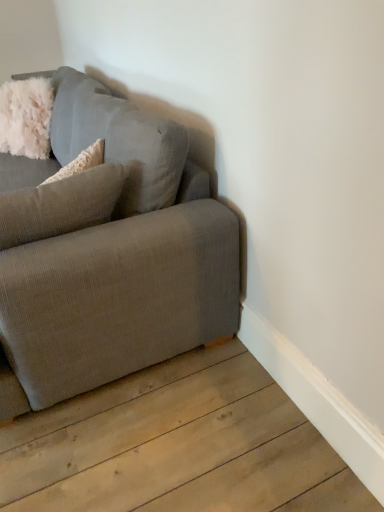
The width and height of the screenshot is (384, 512). Describe the element at coordinates (60, 205) in the screenshot. I see `fluffy white pillow at left` at that location.

Locate an element on the screen. fluffy white pillow at left is located at coordinates (60, 205).

What do you see at coordinates (109, 251) in the screenshot?
I see `textured gray couch at left` at bounding box center [109, 251].

You are a GUI agent. You are given a task and a screenshot of the screen. Output one action in this format:
    pyautogui.click(x=<x>, y=<y>)
    Task: Click on the textured gray couch at left
    The width and height of the screenshot is (384, 512).
    Given the screenshot: What is the action you would take?
    pyautogui.click(x=109, y=251)

Where is `fluffy white pillow at left`? The height and width of the screenshot is (512, 384). fluffy white pillow at left is located at coordinates (60, 205).

Is textured gray couch at left at the left side of fluffy white pillow at left?

Yes, textured gray couch at left is to the left of fluffy white pillow at left.

Is textured gray couch at left further to camera compared to fluffy white pillow at left?

No, the depth of textured gray couch at left is less than that of fluffy white pillow at left.

Is point (207, 197) in front of point (113, 202)?

No, (207, 197) is behind (113, 202).

From the image's perspective, which one is positioned higher, textured gray couch at left or fluffy white pillow at left?

From the image's view, textured gray couch at left is above.

From a real-world perspective, which is physically below, textured gray couch at left or fluffy white pillow at left?

From a 3D spatial view, textured gray couch at left is below.

Can you confirm if textured gray couch at left is wider than fluffy white pillow at left?

Yes, textured gray couch at left is wider than fluffy white pillow at left.

Can you confirm if textured gray couch at left is shorter than fluffy white pillow at left?

In fact, textured gray couch at left may be taller than fluffy white pillow at left.

Based on the photo, does textured gray couch at left have a smaller size compared to fluffy white pillow at left?

No.

Which is correct: textured gray couch at left is inside fluffy white pillow at left, or outside of it?

textured gray couch at left is located beyond the bounds of fluffy white pillow at left.

Does textured gray couch at left touch fluffy white pillow at left?

No.

Could you tell me if textured gray couch at left is facing fluffy white pillow at left?

Yes.

This screenshot has height=512, width=384. In order to click on studio couch located on the left of fluffy white pillow at left in this screenshot , I will do `click(109, 251)`.

Is fluffy white pillow at left to the left of textured gray couch at left from the viewer's perspective?

Incorrect, fluffy white pillow at left is not on the left side of textured gray couch at left.

Which is behind, fluffy white pillow at left or textured gray couch at left?

Positioned behind is fluffy white pillow at left.

Which is in front, point (88, 203) or point (183, 132)?

Positioned in front is point (88, 203).

From the image's perspective, is fluffy white pillow at left positioned above or below textured gray couch at left?

fluffy white pillow at left is below textured gray couch at left.

From a real-world perspective, does fluffy white pillow at left sit lower than textured gray couch at left?

No, from a real-world perspective, fluffy white pillow at left is not under textured gray couch at left.

Which of these two, fluffy white pillow at left or textured gray couch at left, is thinner?

fluffy white pillow at left is thinner.

Who is shorter, fluffy white pillow at left or textured gray couch at left?

fluffy white pillow at left is shorter.

Which of these two, fluffy white pillow at left or textured gray couch at left, is bigger?

With larger size is textured gray couch at left.

Is fluffy white pillow at left completely or partially outside of textured gray couch at left?

No.

Are fluffy white pillow at left and textured gray couch at left far apart?

No, fluffy white pillow at left is in close proximity to textured gray couch at left.

Is fluffy white pillow at left turned away from textured gray couch at left?

Yes, fluffy white pillow at left is facing away from textured gray couch at left.

What are the coordinates of `studio couch that appears in front of the fluffy white pillow at left` in the screenshot? It's located at (109, 251).

Where is `pillow below the textured gray couch at left (from the image's perspective)`? Image resolution: width=384 pixels, height=512 pixels. pillow below the textured gray couch at left (from the image's perspective) is located at coordinates (60, 205).

I want to click on studio couch in front of the fluffy white pillow at left, so click(109, 251).